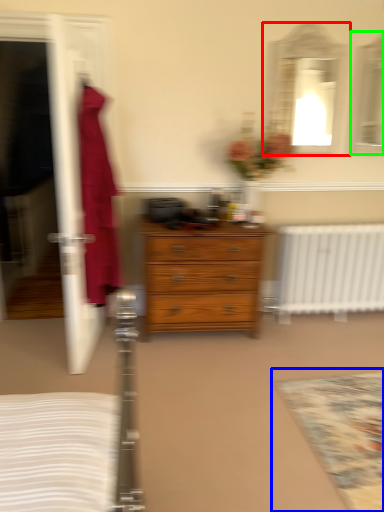
Question: Which is farther away from mirror (highlighted by a red box)? mat (highlighted by a blue box) or mirror (highlighted by a green box)?

Choices:
 (A) mat
 (B) mirror

Answer: (A)